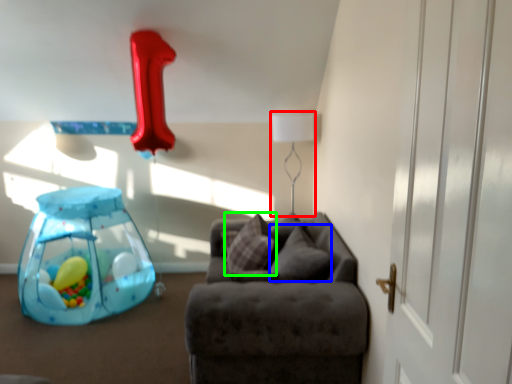
Question: Which object is positioned farthest from table lamp (highlighted by a red box)? Select from pillow (highlighted by a blue box) and pillow (highlighted by a green box).

Choices:
 (A) pillow
 (B) pillow

Answer: (A)